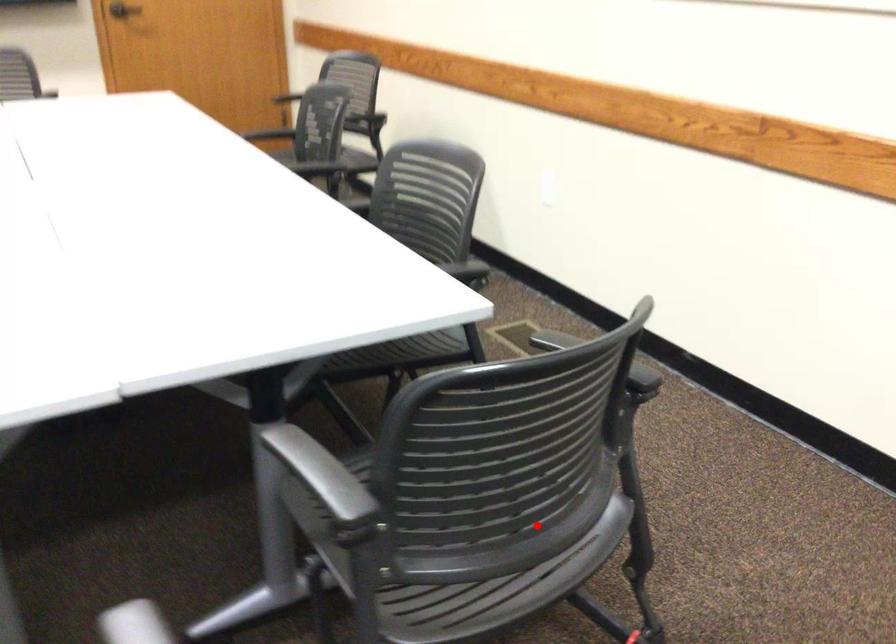
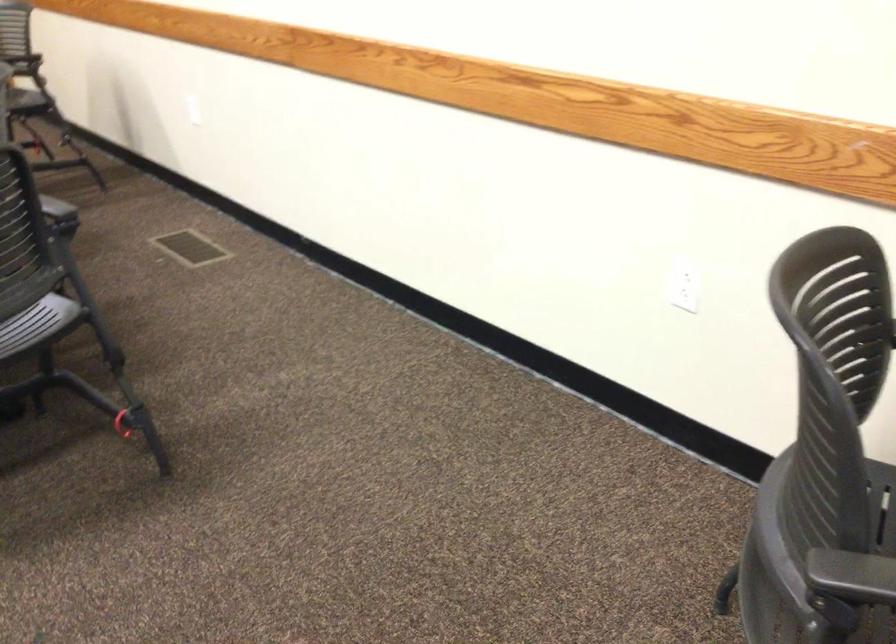
Question: I am providing you with two images of the same scene from different viewpoints. In image1, a red point is highlighted. Considering the same 3D point in image2, which of the following is correct?

Choices:
 (A) It is closer
 (B) It is farther

Answer: (B)